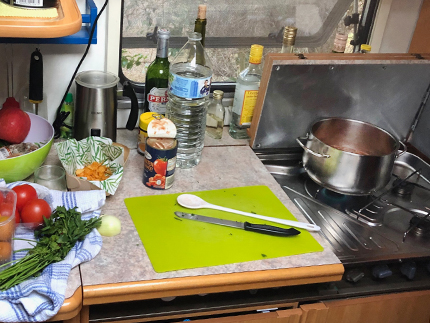
The height and width of the screenshot is (323, 430). I want to click on cut board, so click(x=183, y=245).